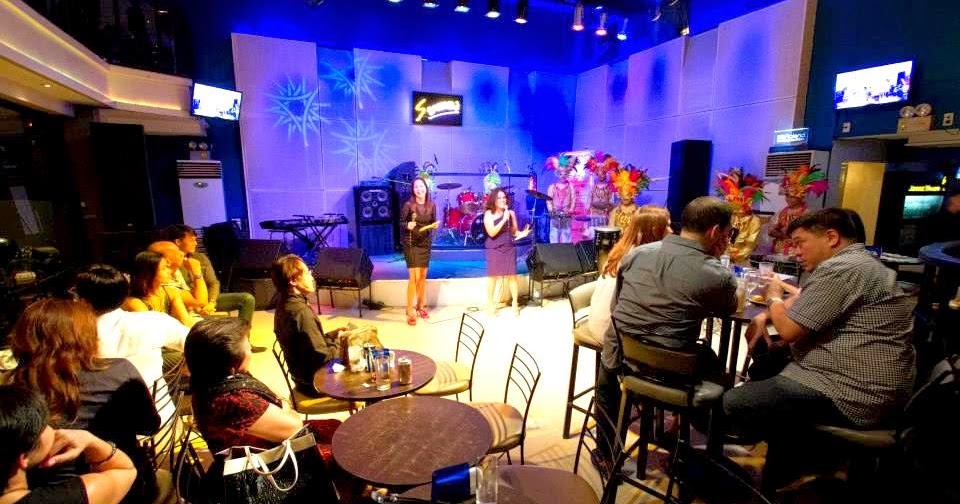
Identify the location of table. The height and width of the screenshot is (504, 960). [x=393, y=426], [x=531, y=481], [x=423, y=353], [x=745, y=315].